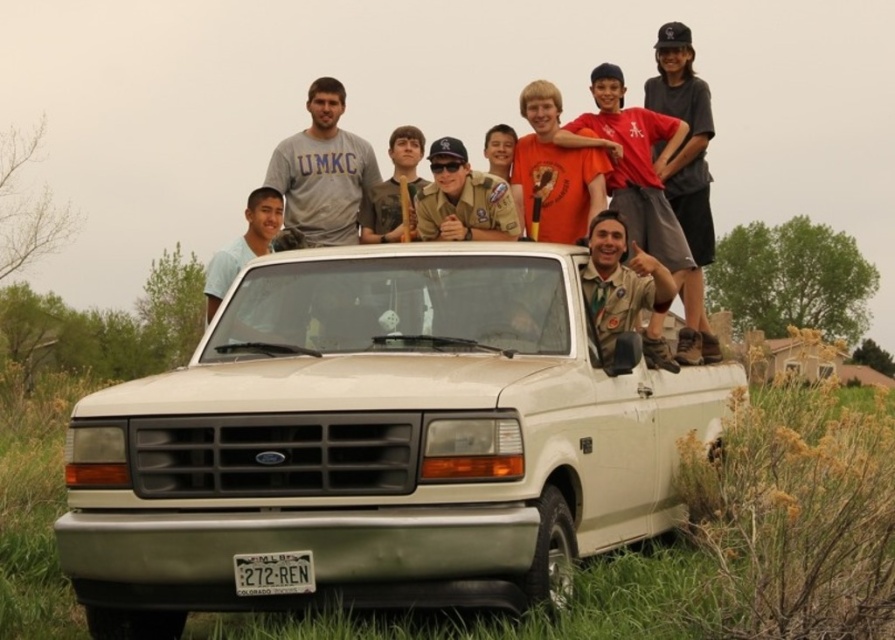
Where is `white matte pickup truck at center`? This screenshot has width=895, height=640. white matte pickup truck at center is located at coordinates (377, 442).

Is point (361, 285) positioned before point (653, 340)?

That is True.

You are a GUI agent. You are given a task and a screenshot of the screen. Output one action in this format:
    pyautogui.click(x=<x>, y=<y>)
    Task: Click on the white matte pickup truck at center
    
    Given the screenshot: What is the action you would take?
    pyautogui.click(x=377, y=442)

Can you confirm if gray cotton t-shirt at upper center is bigger than matte khaki uniform at center?

Yes, gray cotton t-shirt at upper center is bigger than matte khaki uniform at center.

I want to click on gray cotton t-shirt at upper center, so click(322, 172).

Measure the distance between gray cotton t-shirt at upper center and camera.

7.82 meters

Identify the location of gray cotton t-shirt at upper center. (322, 172).

Is white matte pickup truck at center above gray cotton t-shirt at upper center?

No, white matte pickup truck at center is not above gray cotton t-shirt at upper center.

Is point (541, 257) positioned in front of point (303, 166)?

Yes, it is.

This screenshot has height=640, width=895. What are the coordinates of `white matte pickup truck at center` in the screenshot? It's located at 377,442.